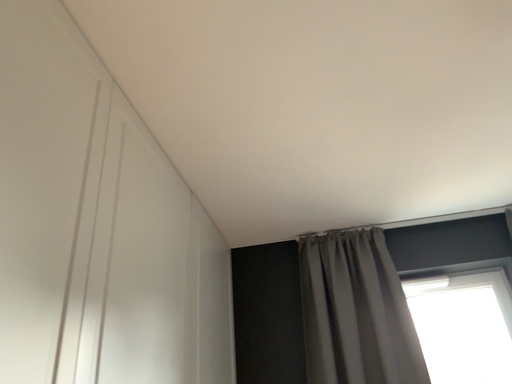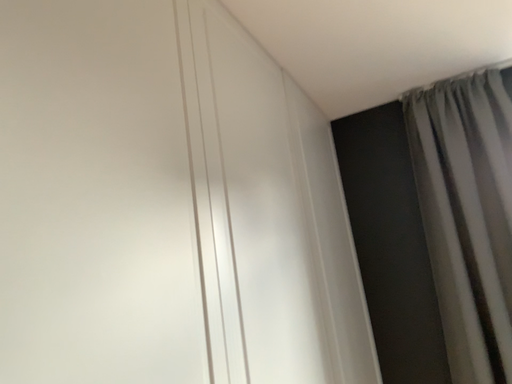
Question: How did the camera likely rotate when shooting the video?

Choices:
 (A) rotated left
 (B) rotated right

Answer: (A)